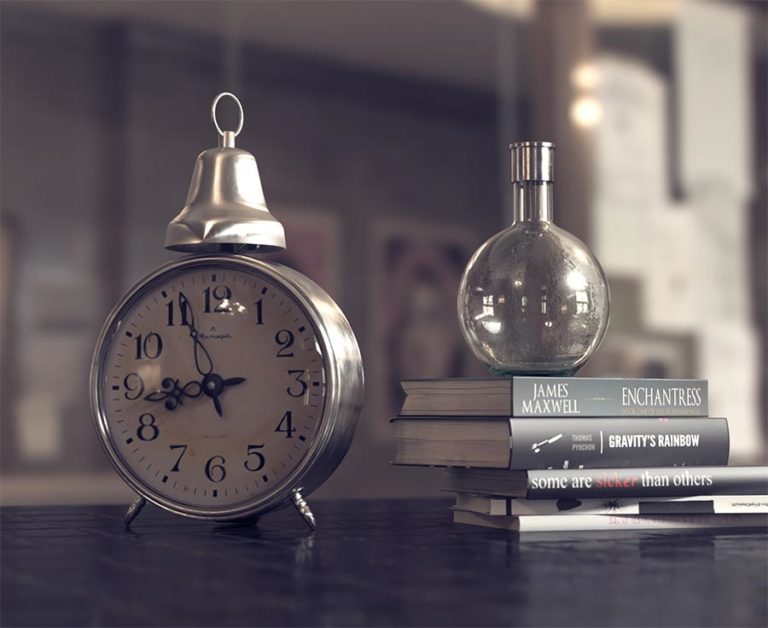
I want to click on two thick books stacked, so click(554, 431), click(557, 389).